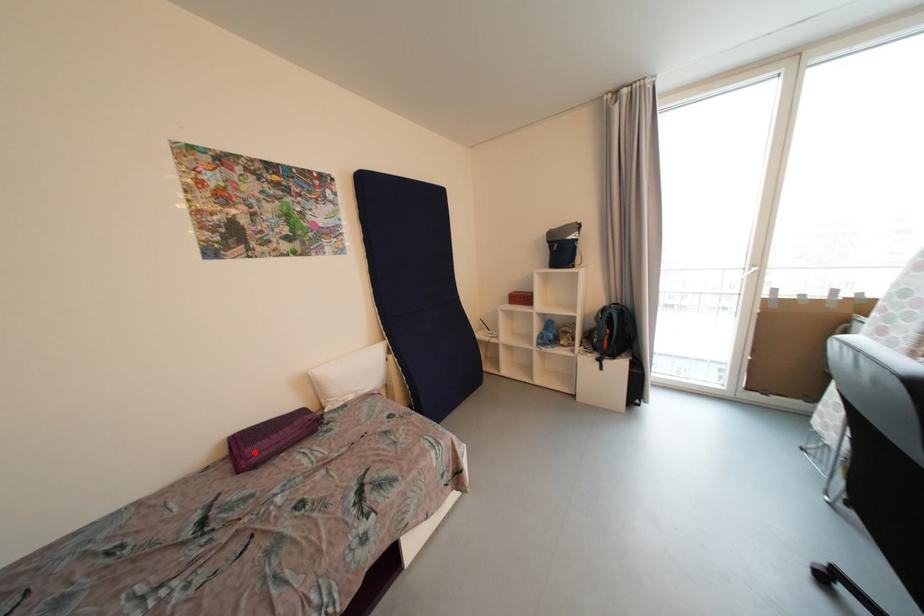
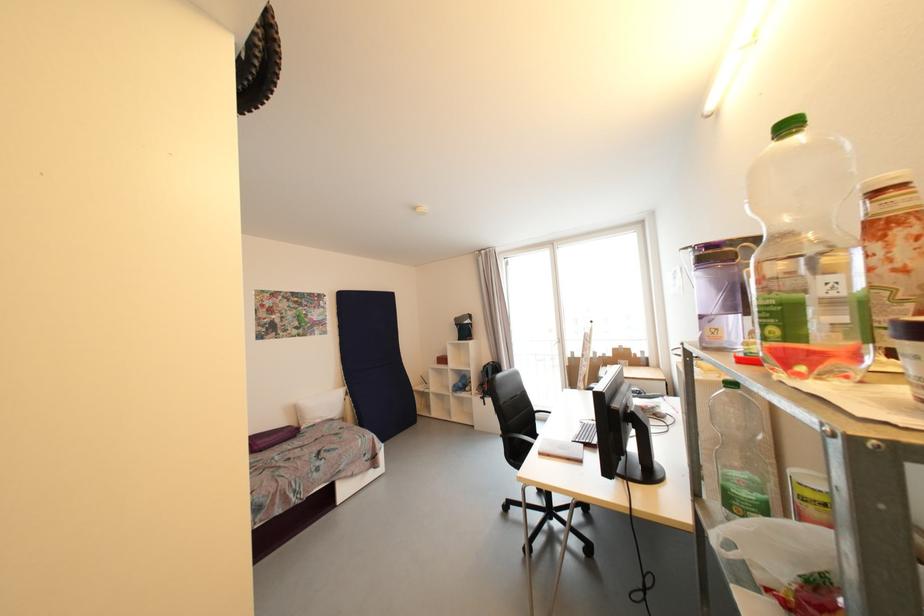
Question: I am providing you with two images of the same scene from different viewpoints. Given a red point in image1, look at the same physical point in image2. Is it:

Choices:
 (A) Closer to the viewpoint
 (B) Farther from the viewpoint

Answer: (B)